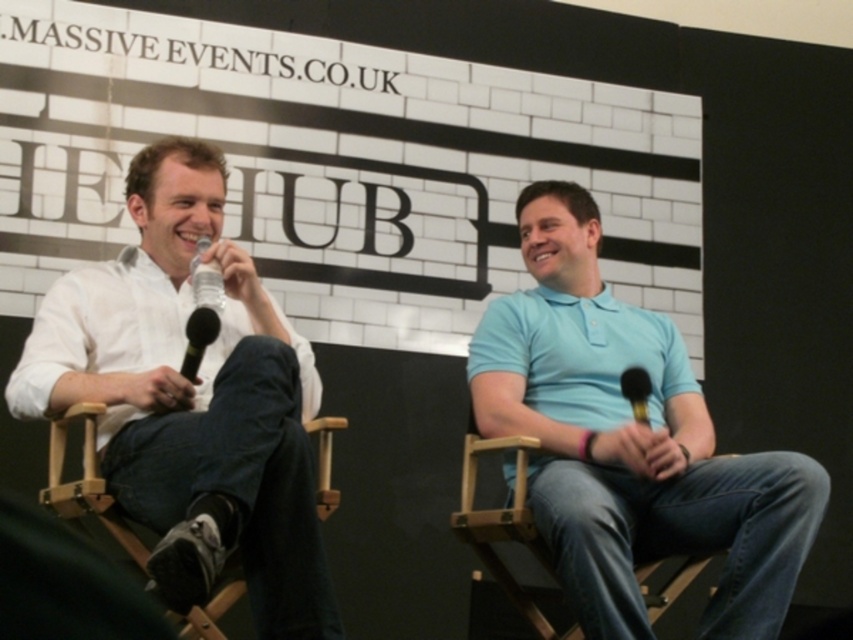
You are standing at the camera position and want to know how far the point marked at coordinates (643, 342) is from you. Can you determine the distance?

The point marked at coordinates (643, 342) is 4.50 meters away from the camera.

Based on the photo, you are a stagehand setting up for a panel discussion. You need to place a 5.5 feet long banner between the light blue polo shirt at center and the black matte microphone at left. Is there enough space between them to fit the banner?

The distance between the light blue polo shirt at center and the black matte microphone at left is 5.30 feet, which is slightly shorter than the 5.5 feet banner. Therefore, the banner may not fit comfortably between them without overlapping or requiring adjustment.